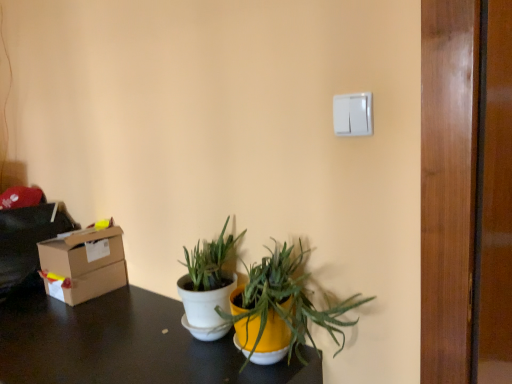
Identify the location of vacant space that is in between cardboard box at left and white matte pot at center, the first houseplant when ordered from left to right. The image size is (512, 384). (136, 316).